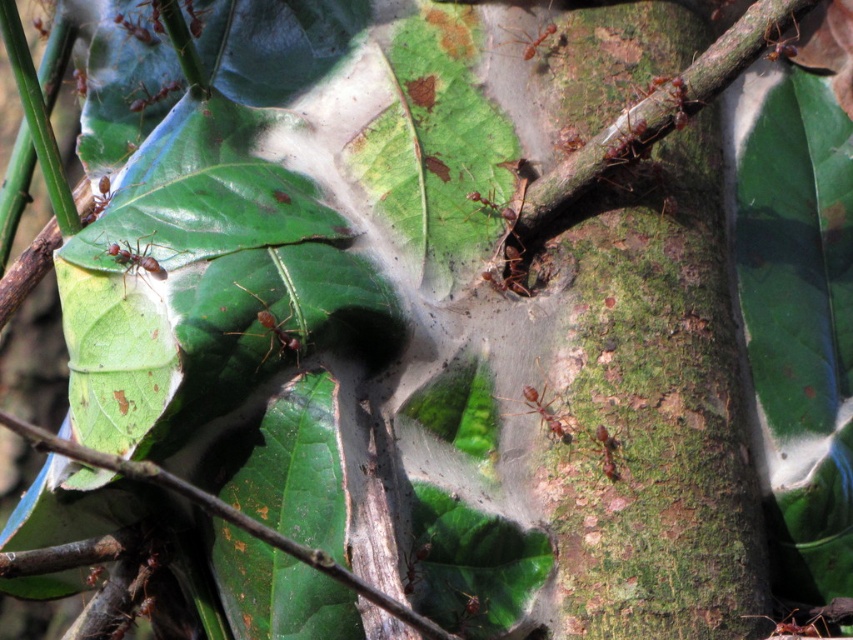
You are holding a ruler and want to measure the distance from your eyes to the green rough bark at right in the image. What is the approximate distance in inches?

The distance of green rough bark at right from viewer is approximately 30.04 inches.

You are an entomologist observing ants in a humid forest. You notice a brown matte ant at center and a red matte ant at upper center. Which ant is taller?

The brown matte ant at center is taller than the red matte ant at upper center.